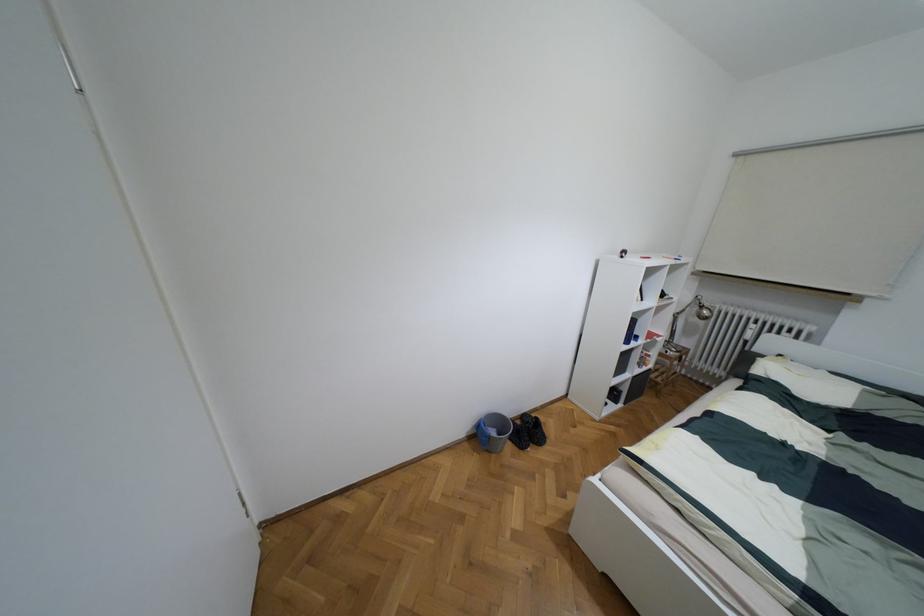
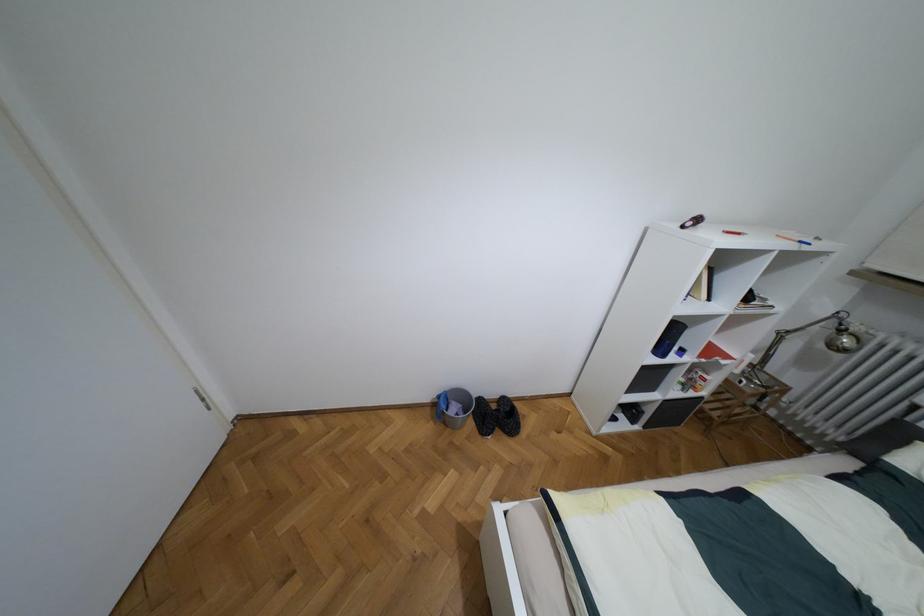
The images are taken continuously from a first-person perspective. In which direction are you moving?

The cameraman walked toward right, forward.